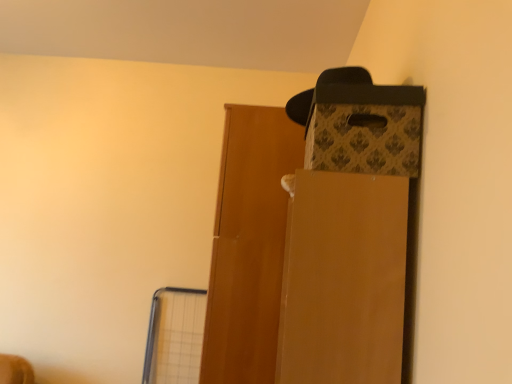
Question: Is matte brown cardboard box at upper right surrounded by patterned cardboard box at upper right?

Choices:
 (A) yes
 (B) no

Answer: (B)

Question: Does patterned cardboard box at upper right have a larger size compared to matte brown cardboard box at upper right?

Choices:
 (A) yes
 (B) no

Answer: (B)

Question: From a real-world perspective, is patterned cardboard box at upper right beneath matte brown cardboard box at upper right?

Choices:
 (A) no
 (B) yes

Answer: (A)

Question: Is patterned cardboard box at upper right in front of matte brown cardboard box at upper right?

Choices:
 (A) no
 (B) yes

Answer: (A)

Question: Is patterned cardboard box at upper right facing away from matte brown cardboard box at upper right?

Choices:
 (A) yes
 (B) no

Answer: (B)

Question: Is patterned cardboard box at upper right wider than matte brown cardboard box at upper right?

Choices:
 (A) no
 (B) yes

Answer: (A)

Question: Considering the relative sizes of wooden door at center and patterned cardboard box at upper right in the image provided, is wooden door at center wider than patterned cardboard box at upper right?

Choices:
 (A) yes
 (B) no

Answer: (A)

Question: Is wooden door at center bigger than patterned cardboard box at upper right?

Choices:
 (A) yes
 (B) no

Answer: (A)

Question: Is wooden door at center further to camera compared to patterned cardboard box at upper right?

Choices:
 (A) no
 (B) yes

Answer: (B)

Question: Does wooden door at center have a lesser width compared to patterned cardboard box at upper right?

Choices:
 (A) no
 (B) yes

Answer: (A)

Question: Can you confirm if wooden door at center is taller than patterned cardboard box at upper right?

Choices:
 (A) yes
 (B) no

Answer: (A)

Question: Considering the relative positions of wooden door at center and patterned cardboard box at upper right in the image provided, is wooden door at center to the left of patterned cardboard box at upper right from the viewer's perspective?

Choices:
 (A) yes
 (B) no

Answer: (A)

Question: From a real-world perspective, is wooden door at center physically above matte brown cardboard box at upper right?

Choices:
 (A) yes
 (B) no

Answer: (A)